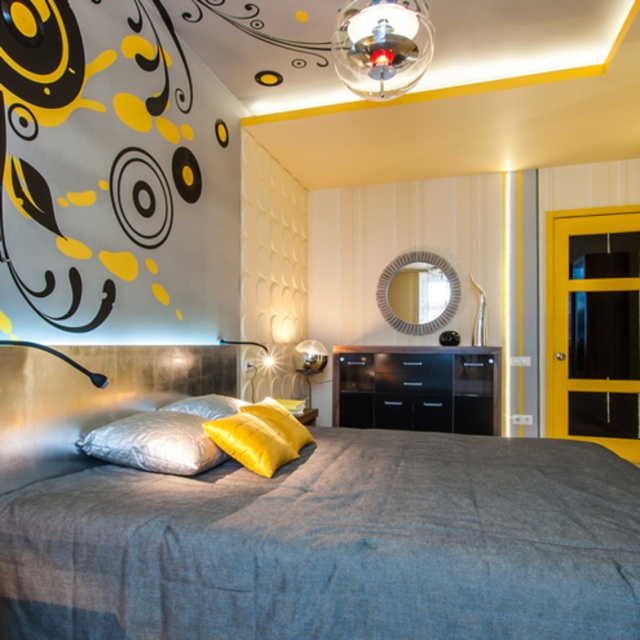
Does black glossy dresser at center appear under matte black lamp at left?

Yes, black glossy dresser at center is below matte black lamp at left.

Find the location of `black glossy dresser at center`. black glossy dresser at center is located at coordinates (417, 388).

Between textured gray bed at center and matte black lamp at left, which one has less height?

With less height is matte black lamp at left.

Does textured gray bed at center lie in front of matte black lamp at left?

Yes, textured gray bed at center is in front of matte black lamp at left.

Locate an element on the screen. This screenshot has height=640, width=640. textured gray bed at center is located at coordinates (300, 524).

Can you confirm if transparent glass sphere at upper center is thinner than satin silver pillow at center?

Correct, transparent glass sphere at upper center's width is less than satin silver pillow at center's.

Which of these two, transparent glass sphere at upper center or satin silver pillow at center, stands shorter?

Standing shorter between the two is satin silver pillow at center.

Which is behind, point (369, 84) or point (166, 452)?

Point (369, 84)

What are the coordinates of `transparent glass sphere at upper center` in the screenshot? It's located at [x=381, y=45].